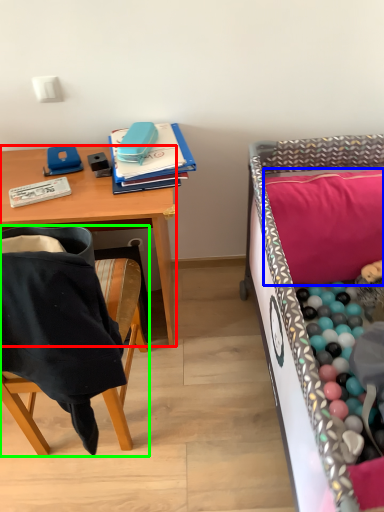
Question: Which is farther away from desk (highlighted by a red box)? pillow (highlighted by a blue box) or chair (highlighted by a green box)?

Choices:
 (A) pillow
 (B) chair

Answer: (A)